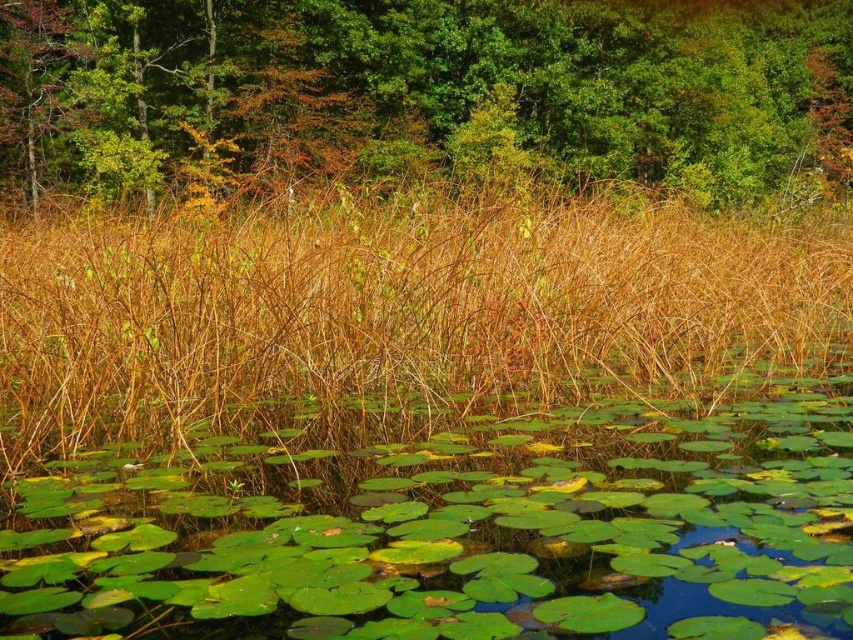
Is point (9, 582) farther from viewer compared to point (541, 28)?

No, it is in front of (541, 28).

Find the location of a particular element. This screenshot has width=853, height=640. green glossy lily pads at center is located at coordinates [459, 518].

Which is above, green leafy tree at upper center or brown dry grass at center?

green leafy tree at upper center

This screenshot has width=853, height=640. What do you see at coordinates (427, 96) in the screenshot? I see `green leafy tree at upper center` at bounding box center [427, 96].

The height and width of the screenshot is (640, 853). Find the location of `green leafy tree at upper center`. green leafy tree at upper center is located at coordinates (427, 96).

Between point (0, 566) and point (82, 266), which one is positioned in front?

Point (0, 566) is more forward.

Is green glossy lily pads at center taller than brown dry grass at center?

Incorrect, green glossy lily pads at center's height is not larger of brown dry grass at center's.

Where is `green glossy lily pads at center`? This screenshot has height=640, width=853. green glossy lily pads at center is located at coordinates (459, 518).

The height and width of the screenshot is (640, 853). I want to click on green glossy lily pads at center, so coord(459,518).